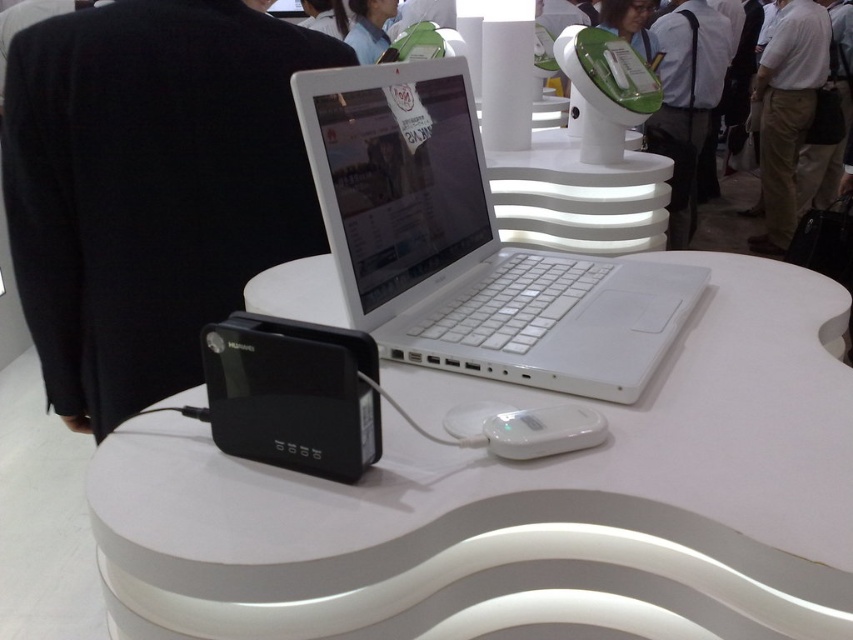
You are a photographer standing at the back of the exhibition hall. You want to take a clear photo of the white glossy table at center without the black fabric jacket at left blocking the view. Is the jacket currently in the way?

The white glossy table at center is closer to the viewer than the black fabric jacket at left, so the table will block the jacket from the photographer at the back. Therefore, the jacket is not in the way of the table in the photo.